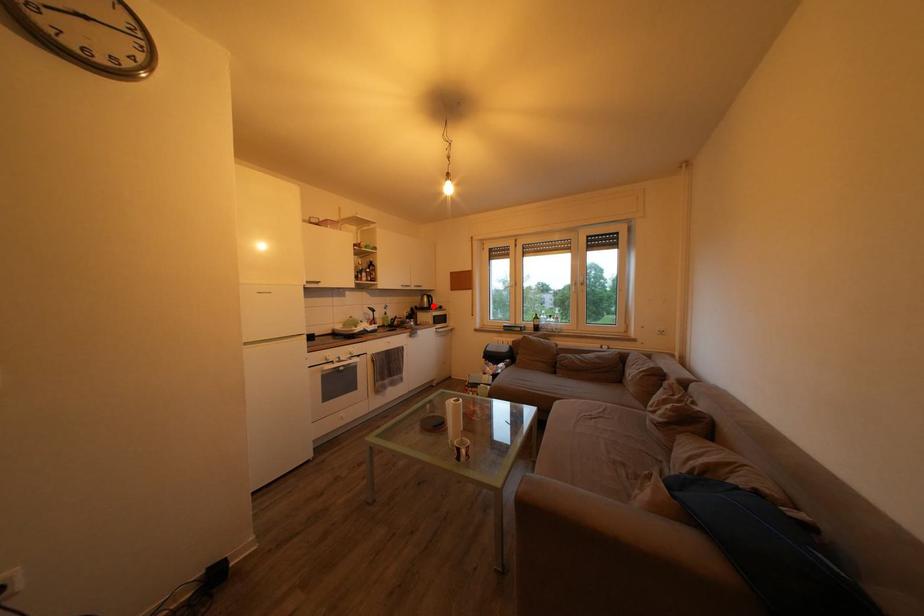
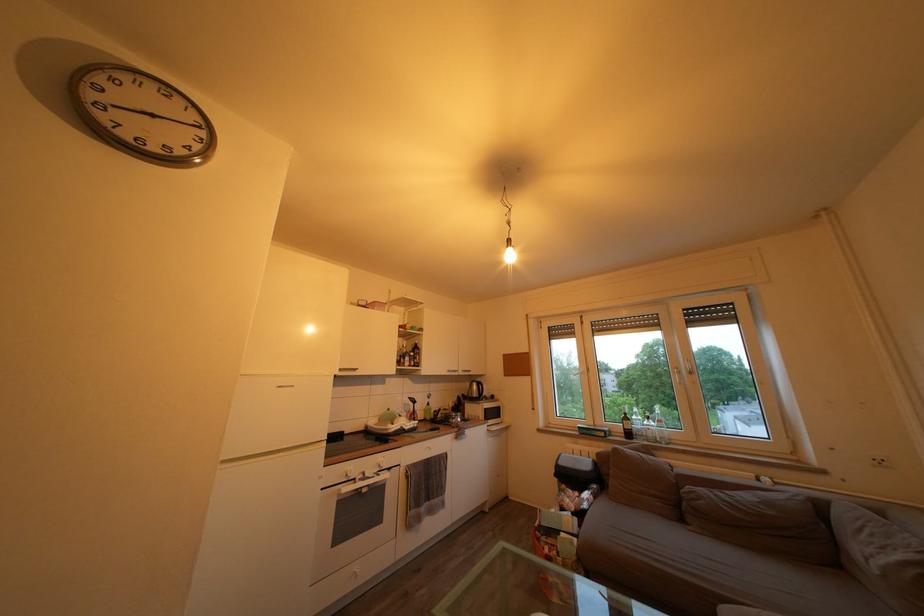
In the second image, find the point that corresponds to the highlighted location in the first image.

(482, 392)